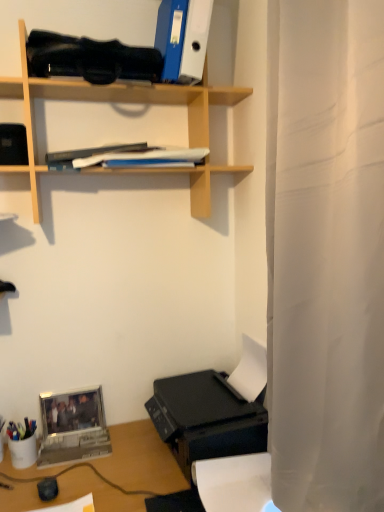
Question: From a real-world perspective, is black plastic printer at lower right positioned over metallic silver laptop at lower left based on gravity?

Choices:
 (A) no
 (B) yes

Answer: (B)

Question: Is black plastic printer at lower right oriented towards metallic silver laptop at lower left?

Choices:
 (A) no
 (B) yes

Answer: (B)

Question: Is metallic silver laptop at lower left at the back of black plastic printer at lower right?

Choices:
 (A) yes
 (B) no

Answer: (B)

Question: From the image's perspective, is black plastic printer at lower right on metallic silver laptop at lower left?

Choices:
 (A) no
 (B) yes

Answer: (B)

Question: Does black plastic printer at lower right have a smaller size compared to metallic silver laptop at lower left?

Choices:
 (A) yes
 (B) no

Answer: (B)

Question: From the image's perspective, is blue matte folder at upper center above or below white fabric shower curtain at right?

Choices:
 (A) below
 (B) above

Answer: (B)

Question: Is point (203, 24) closer or farther from the camera than point (278, 13)?

Choices:
 (A) farther
 (B) closer

Answer: (A)

Question: Would you say blue matte folder at upper center is inside or outside white fabric shower curtain at right?

Choices:
 (A) inside
 (B) outside

Answer: (B)

Question: From a real-world perspective, is blue matte folder at upper center physically located above or below white fabric shower curtain at right?

Choices:
 (A) below
 (B) above

Answer: (B)

Question: Considering their positions, is white fabric shower curtain at right located in front of or behind wooden shelf at upper center?

Choices:
 (A) front
 (B) behind

Answer: (A)

Question: From a real-world perspective, is white fabric shower curtain at right above or below wooden shelf at upper center?

Choices:
 (A) above
 (B) below

Answer: (B)

Question: From the image's perspective, relative to wooden shelf at upper center, is white fabric shower curtain at right above or below?

Choices:
 (A) above
 (B) below

Answer: (B)

Question: Visually, is white fabric shower curtain at right positioned to the left or to the right of wooden shelf at upper center?

Choices:
 (A) right
 (B) left

Answer: (A)

Question: From the image's perspective, is wooden shelf at upper center positioned above or below metallic silver laptop at lower left?

Choices:
 (A) below
 (B) above

Answer: (B)

Question: Looking at the image, does wooden shelf at upper center seem bigger or smaller compared to metallic silver laptop at lower left?

Choices:
 (A) big
 (B) small

Answer: (A)